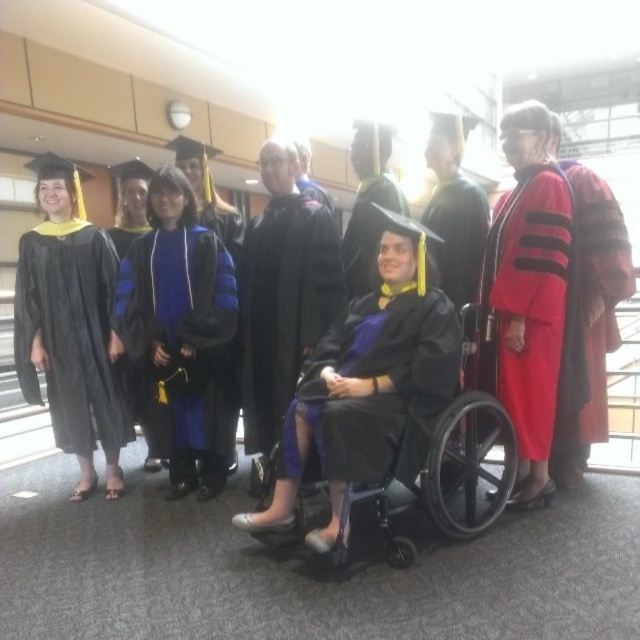
In the scene shown: Can you confirm if matte black gown at center is positioned below matte black graduation gown at center?

Correct, matte black gown at center is located below matte black graduation gown at center.

Does matte black gown at center appear on the right side of matte black graduation gown at center?

No, matte black gown at center is not to the right of matte black graduation gown at center.

Identify the location of matte black gown at center. Image resolution: width=640 pixels, height=640 pixels. (378, 392).

Is point (484, 454) in front of point (346, 244)?

Yes, it is.

Locate an element on the screen. black plastic wheelchair at center is located at coordinates (467, 465).

Does point (508, 426) lie behind point (353, 266)?

No, it is in front of (353, 266).

At what (x,y) coordinates should I click in order to perform the action: click on black plastic wheelchair at center. Please return your answer as a coordinate pair (x, y). Looking at the image, I should click on (467, 465).

Is matte black gown at center bigger than blue velvet gown at center?

Yes.

Is matte black gown at center taller than blue velvet gown at center?

In fact, matte black gown at center may be shorter than blue velvet gown at center.

Is point (406, 349) closer to viewer compared to point (209, 266)?

Yes.

Identify the location of matte black gown at center. The height and width of the screenshot is (640, 640). (378, 392).